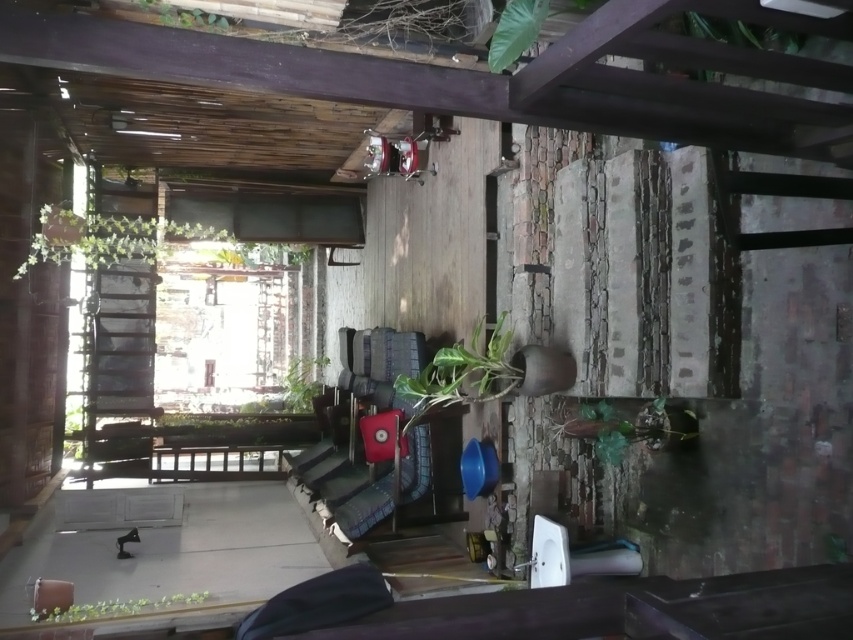
Can you confirm if green glossy plant at center is positioned to the right of green matte plant at center?

Indeed, green glossy plant at center is positioned on the right side of green matte plant at center.

Can you confirm if green glossy plant at center is wider than green matte plant at center?

In fact, green glossy plant at center might be narrower than green matte plant at center.

Identify the location of green glossy plant at center. (462, 374).

Does green matte plant at lower left have a lesser width compared to green matte plant at center?

No, green matte plant at lower left is not thinner than green matte plant at center.

Can you confirm if green matte plant at lower left is positioned to the left of green matte plant at center?

Indeed, green matte plant at lower left is positioned on the left side of green matte plant at center.

Locate an element on the screen. This screenshot has height=640, width=853. green matte plant at lower left is located at coordinates coord(115,608).

Find the location of a particular element. Image resolution: width=853 pixels, height=640 pixels. green matte plant at lower left is located at coordinates (115, 608).

Is green glossy plant at center to the right of green leafy plant at upper center from the viewer's perspective?

Yes, green glossy plant at center is to the right of green leafy plant at upper center.

How distant is green glossy plant at center from green leafy plant at upper center?

A distance of 8.02 feet exists between green glossy plant at center and green leafy plant at upper center.

Between point (456, 380) and point (207, 28), which one is positioned in front?

Point (456, 380) is more forward.

The width and height of the screenshot is (853, 640). Identify the location of green glossy plant at center. (462, 374).